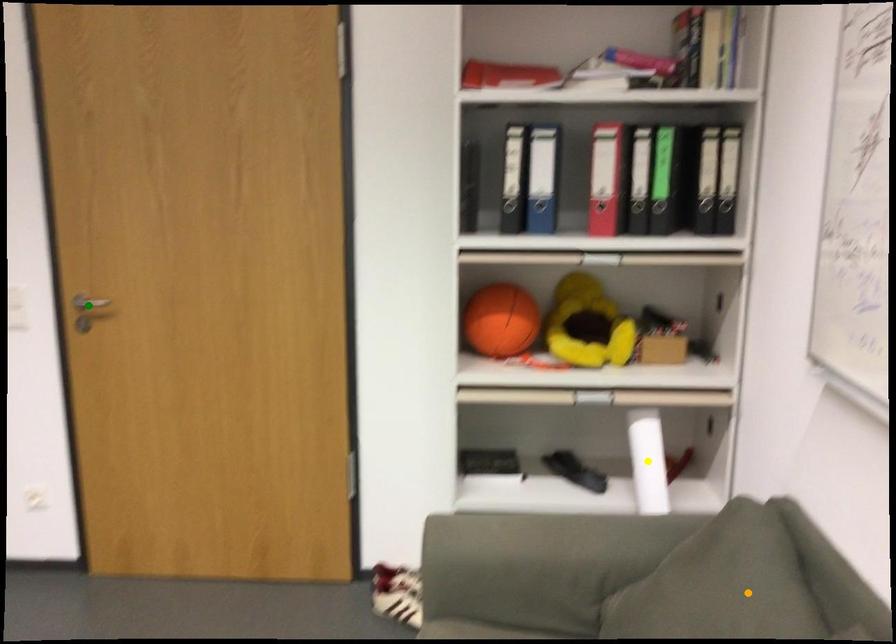
Order these from nearest to farthest:
green point
orange point
yellow point

orange point, yellow point, green point